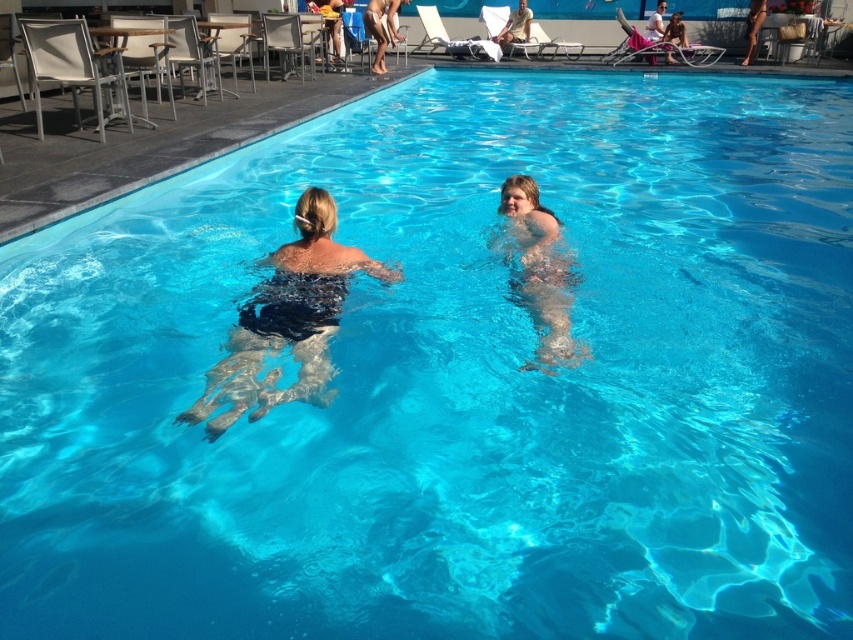
Is smooth skin at center wider than matte black bikini at upper center?

In fact, smooth skin at center might be narrower than matte black bikini at upper center.

In the scene shown: Who is lower down, smooth skin at center or matte black bikini at upper center?

smooth skin at center is lower down.

Image resolution: width=853 pixels, height=640 pixels. Identify the location of smooth skin at center. (287, 321).

Is smooth skin at center below smooth skin child at center?

Correct, smooth skin at center is located below smooth skin child at center.

Who is shorter, smooth skin at center or smooth skin child at center?

smooth skin child at center

Describe the element at coordinates (287, 321) in the screenshot. I see `smooth skin at center` at that location.

Where is `smooth skin at center`? The image size is (853, 640). smooth skin at center is located at coordinates (287, 321).

Can you confirm if smooth skin child at center is taller than matte black bikini at upper center?

No, smooth skin child at center is not taller than matte black bikini at upper center.

Does smooth skin child at center lie behind matte black bikini at upper center?

No, smooth skin child at center is closer to the viewer.

Who is more forward, (553, 346) or (514, 12)?

Positioned in front is point (553, 346).

Image resolution: width=853 pixels, height=640 pixels. In order to click on smooth skin child at center in this screenshot , I will do `click(540, 273)`.